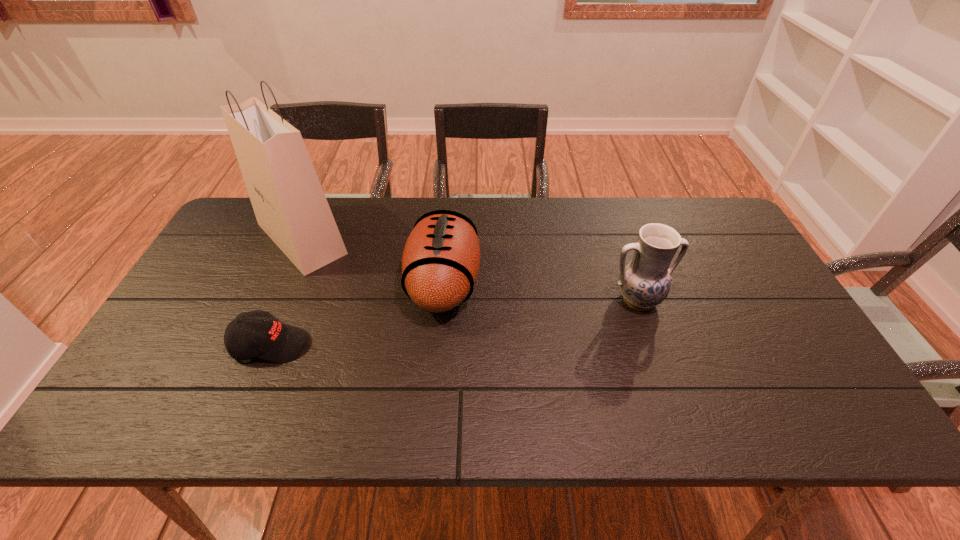
Find the location of a particular element. The height and width of the screenshot is (540, 960). vacant point that satisfies the following two spatial constraints: 1. on the front side of the pottery; 2. on the left side of the tallest object is located at coordinates (275, 300).